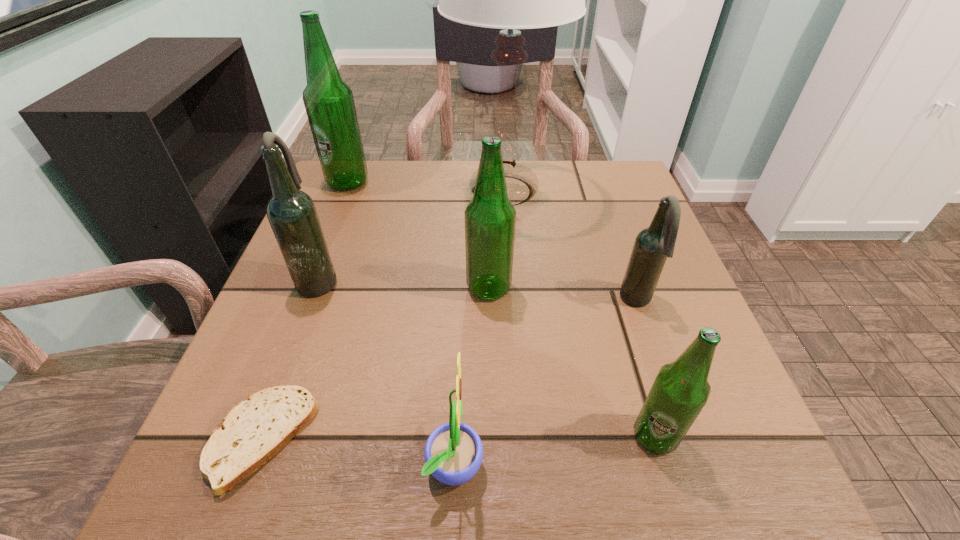
The image size is (960, 540). I want to click on free region located on the front-facing side of the sunflower, so click(639, 461).

Identify the location of free space located on the back of the shortest object. Image resolution: width=960 pixels, height=540 pixels. (330, 253).

Identify the location of table lamp at the far edge. The width and height of the screenshot is (960, 540). (509, 0).

The width and height of the screenshot is (960, 540). Find the location of `beer bottle that is positioned at the far edge`. beer bottle that is positioned at the far edge is located at coordinates (329, 103).

At what (x,y) coordinates should I click in order to perform the action: click on beer bottle present at the near edge. Please return your answer as a coordinate pair (x, y). Looking at the image, I should click on (680, 391).

Find the location of a particular element. Image resolution: width=960 pixels, height=540 pixels. sunflower that is positioned at the near edge is located at coordinates pos(453,453).

Where is `pita bread present at the near edge`? Image resolution: width=960 pixels, height=540 pixels. pita bread present at the near edge is located at coordinates (253, 431).

Find the location of `pita bread located in the left edge section of the desktop`. pita bread located in the left edge section of the desktop is located at coordinates (253, 431).

Where is `object located in the far left corner section of the desktop`? The image size is (960, 540). object located in the far left corner section of the desktop is located at coordinates (329, 103).

Where is `object at the near left corner`? object at the near left corner is located at coordinates (253, 431).